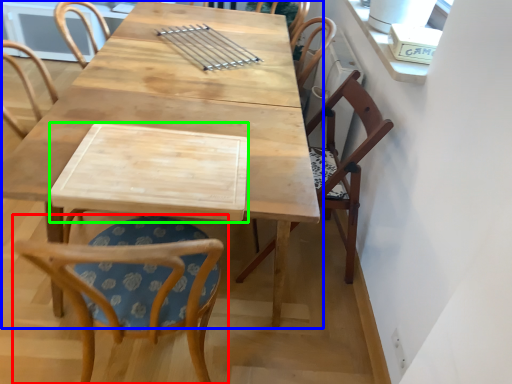
Question: Considering the real-world distances, which object is closest to chair (highlighted by a red box)? table (highlighted by a blue box) or plank (highlighted by a green box).

Choices:
 (A) table
 (B) plank

Answer: (B)